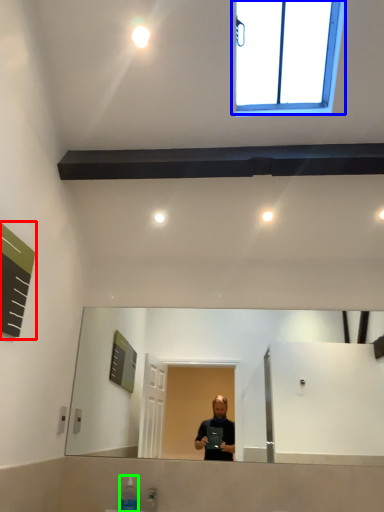
Question: Based on their relative distances, which object is nearer to bulletin board (highlighted by a red box)? Choose from window (highlighted by a blue box) and toiletry (highlighted by a green box).

Choices:
 (A) window
 (B) toiletry

Answer: (B)